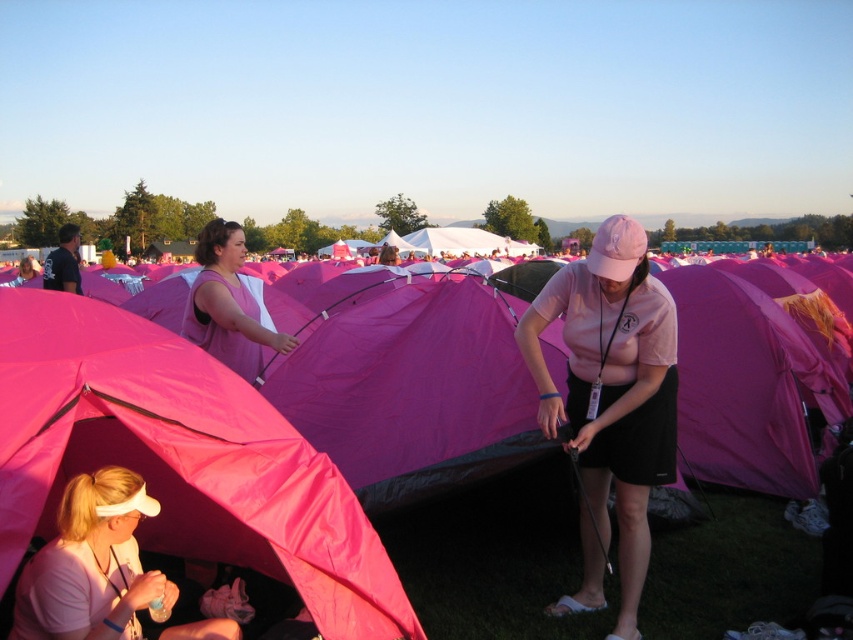
Question: Is pink matte shirt at center thinner than pink matte visor at lower left?

Choices:
 (A) yes
 (B) no

Answer: (B)

Question: Among these objects, which one is farthest from the camera?

Choices:
 (A) pink matte visor at lower left
 (B) pink fabric tent at lower left

Answer: (A)

Question: Does pink fabric tent at lower left appear on the right side of matte pink tent at center?

Choices:
 (A) no
 (B) yes

Answer: (B)

Question: Is pink fabric tent at lower left wider than pink matte shirt at center?

Choices:
 (A) no
 (B) yes

Answer: (B)

Question: Which point is closer to the camera?

Choices:
 (A) (154, 595)
 (B) (434, 589)

Answer: (A)

Question: Which object is farther from the camera taking this photo?

Choices:
 (A) pink matte visor at lower left
 (B) pink fabric tent at lower left
 (C) matte pink tent at center

Answer: (C)